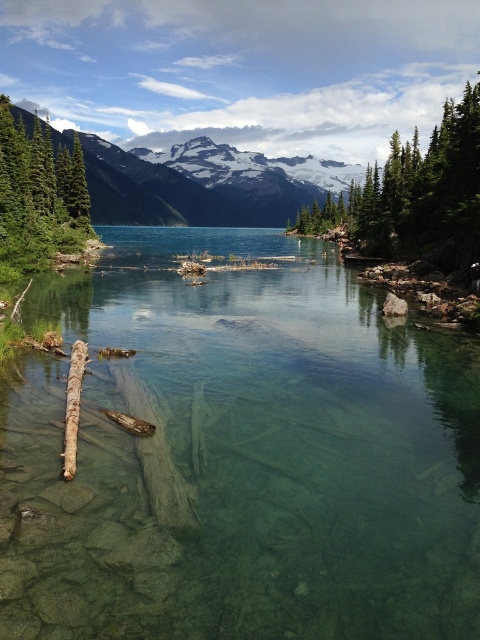
Is clear glassy water at center in front of brown rough log at lower left?

That is True.

Who is taller, clear glassy water at center or brown rough log at lower left?

With more height is clear glassy water at center.

In order to click on clear glassy water at center in this screenshot , I will do `click(240, 456)`.

Is green matte tree at upper left to the right of brown rough log at lower left from the viewer's perspective?

Incorrect, green matte tree at upper left is not on the right side of brown rough log at lower left.

Describe the element at coordinates (38, 196) in the screenshot. I see `green matte tree at upper left` at that location.

Locate an element on the screen. The width and height of the screenshot is (480, 640). green matte tree at upper left is located at coordinates tap(38, 196).

From the picture: Is green leafy tree at upper right taller than snowy granite mountain at upper center?

Correct, green leafy tree at upper right is much taller as snowy granite mountain at upper center.

Does green leafy tree at upper right have a lesser height compared to snowy granite mountain at upper center?

No, green leafy tree at upper right is not shorter than snowy granite mountain at upper center.

What are the coordinates of `green leafy tree at upper right` in the screenshot? It's located at pos(425,193).